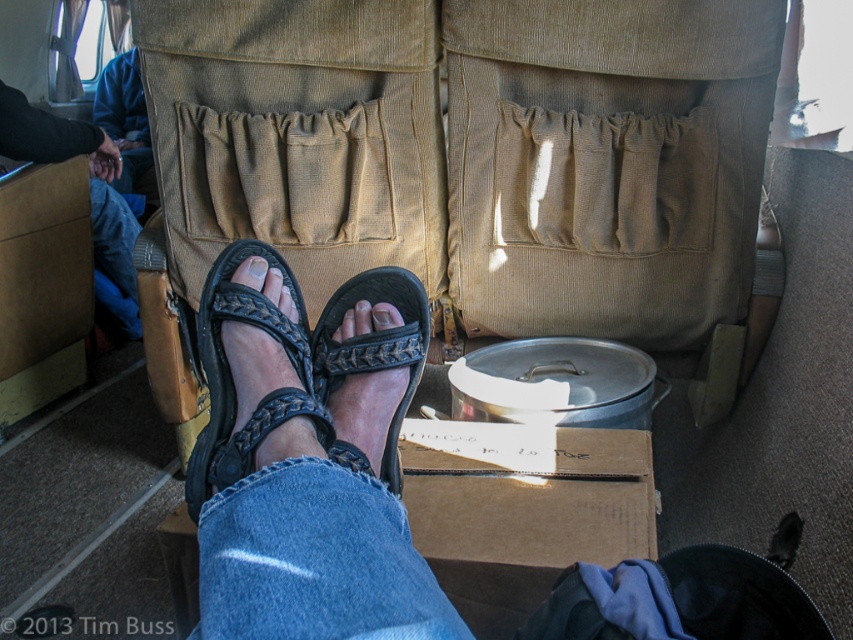
Question: Is black woven sandals at center positioned at the back of brown cardboard box at center?

Choices:
 (A) yes
 (B) no

Answer: (B)

Question: Is black woven sandals at center bigger than brown cardboard box at center?

Choices:
 (A) no
 (B) yes

Answer: (B)

Question: Does black woven sandals at center appear on the right side of black woven sandal at center?

Choices:
 (A) yes
 (B) no

Answer: (B)

Question: Among these objects, which one is farthest from the camera?

Choices:
 (A) brown cardboard box at center
 (B) black woven sandal at center
 (C) black woven sandals at center
 (D) blue denim jeans at upper left

Answer: (D)

Question: Which of the following is the farthest from the observer?

Choices:
 (A) black woven sandals at center
 (B) leather/black textured sandals at center
 (C) brown cardboard box at center
 (D) blue denim jeans at upper left

Answer: (D)

Question: Among these points, which one is nearest to the camera?

Choices:
 (A) (x=361, y=394)
 (B) (x=357, y=298)
 (C) (x=405, y=442)
 (D) (x=287, y=266)

Answer: (A)